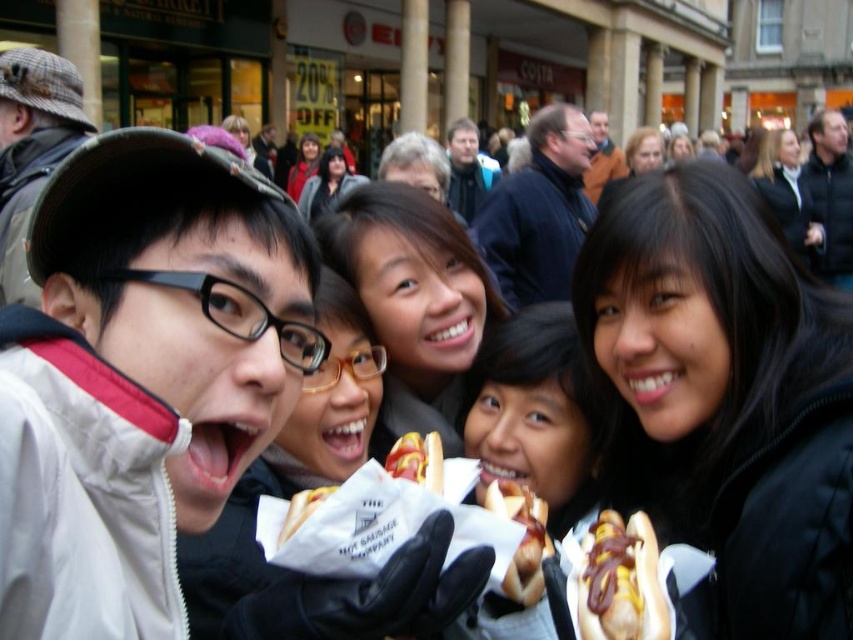
Does shiny brown hot dog at center appear on the right side of golden brown bun at center?

Indeed, shiny brown hot dog at center is positioned on the right side of golden brown bun at center.

Between point (648, 625) and point (521, 522), which one is positioned behind?

The point (521, 522) is behind.

This screenshot has width=853, height=640. I want to click on shiny brown hot dog at center, so click(x=621, y=580).

Does point (543, 573) lie in front of point (288, 515)?

That is True.

Measure the distance between point (488, 492) and camera.

A distance of 36.88 meters exists between point (488, 492) and camera.

This screenshot has height=640, width=853. Identify the location of golden brown bun at center. (521, 538).

Who is taller, smooth yellow hot dog at center or white paper hot dog at center?

Standing taller between the two is white paper hot dog at center.

Is point (434, 467) farther from camera compared to point (328, 497)?

Yes, point (434, 467) is farther from viewer.

Describe the element at coordinates (416, 460) in the screenshot. This screenshot has width=853, height=640. I see `smooth yellow hot dog at center` at that location.

Where is `smooth yellow hot dog at center`? smooth yellow hot dog at center is located at coordinates (416, 460).